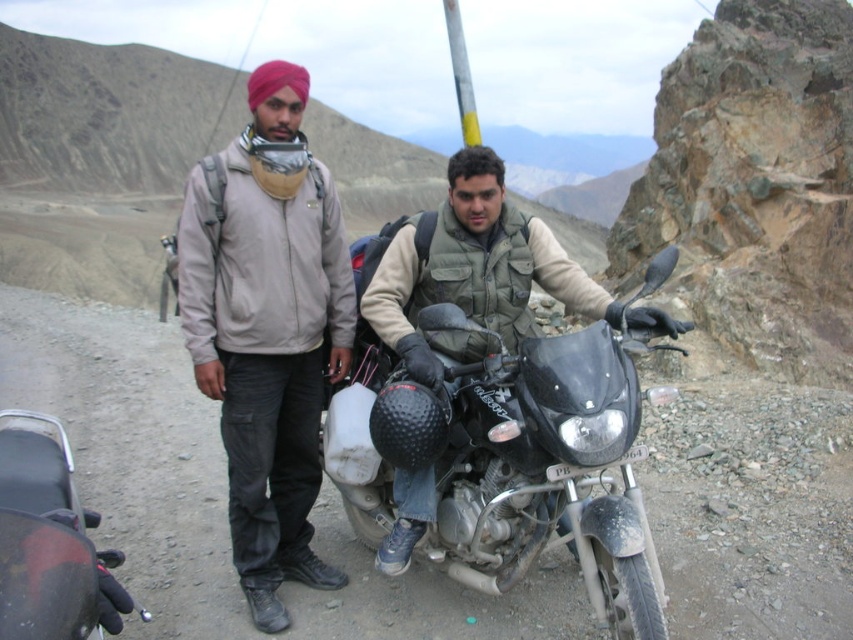
Who is more distant from viewer, [276,419] or [268,188]?

The point [276,419] is behind.

Does point (320, 321) lie in front of point (302, 145)?

No, it is behind (302, 145).

The image size is (853, 640). What are the coordinates of `matte khaki jacket at center` in the screenshot? It's located at (267, 328).

In the scene shown: Can you confirm if matte khaki jacket at center is bigger than matte black helmet at center?

Actually, matte khaki jacket at center might be smaller than matte black helmet at center.

Between matte khaki jacket at center and matte black helmet at center, which one appears on the left side from the viewer's perspective?

matte khaki jacket at center

Which is in front, point (321, 346) or point (407, 307)?

Positioned in front is point (407, 307).

The width and height of the screenshot is (853, 640). Find the location of `matte khaki jacket at center`. matte khaki jacket at center is located at coordinates coord(267,328).

Is matte black helmet at center thinner than beige fabric headscarf at center?

In fact, matte black helmet at center might be wider than beige fabric headscarf at center.

Does matte black helmet at center appear under beige fabric headscarf at center?

Indeed, matte black helmet at center is positioned under beige fabric headscarf at center.

Describe the element at coordinates (473, 273) in the screenshot. I see `matte black helmet at center` at that location.

The width and height of the screenshot is (853, 640). What are the coordinates of `matte black helmet at center` in the screenshot? It's located at (473, 273).